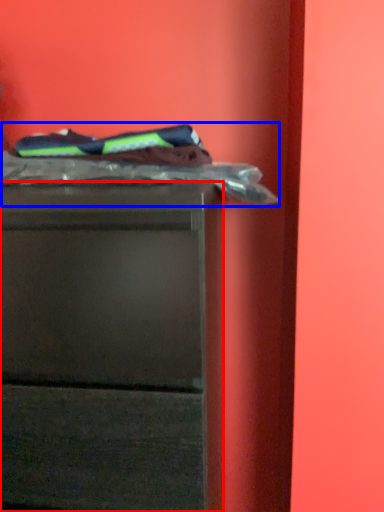
Question: Which of the following is the closest to the observer, chest of drawers (highlighted by a red box) or laundry (highlighted by a blue box)?

Choices:
 (A) chest of drawers
 (B) laundry

Answer: (A)